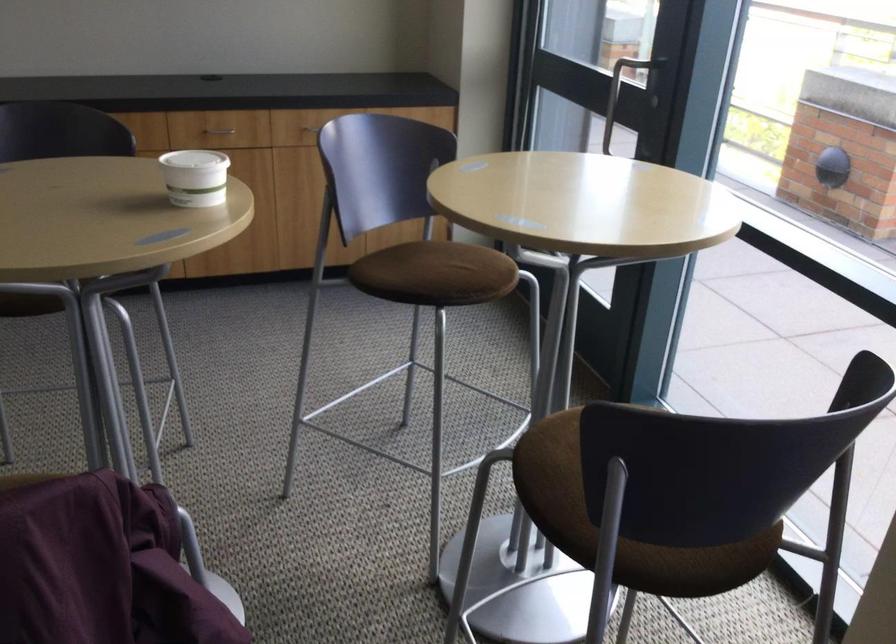
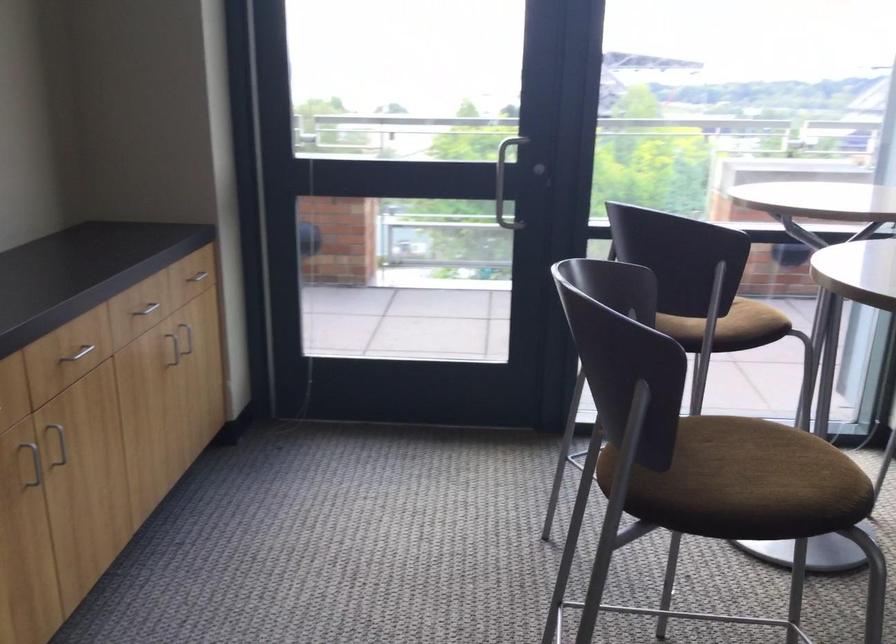
Locate, in the second image, the point that corresponds to (237,172) in the first image.

(36, 465)